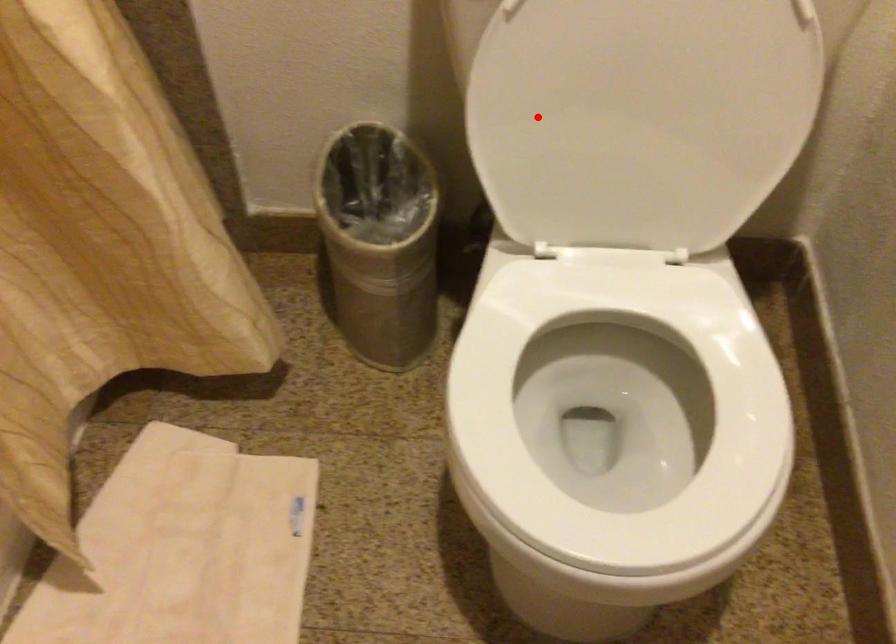
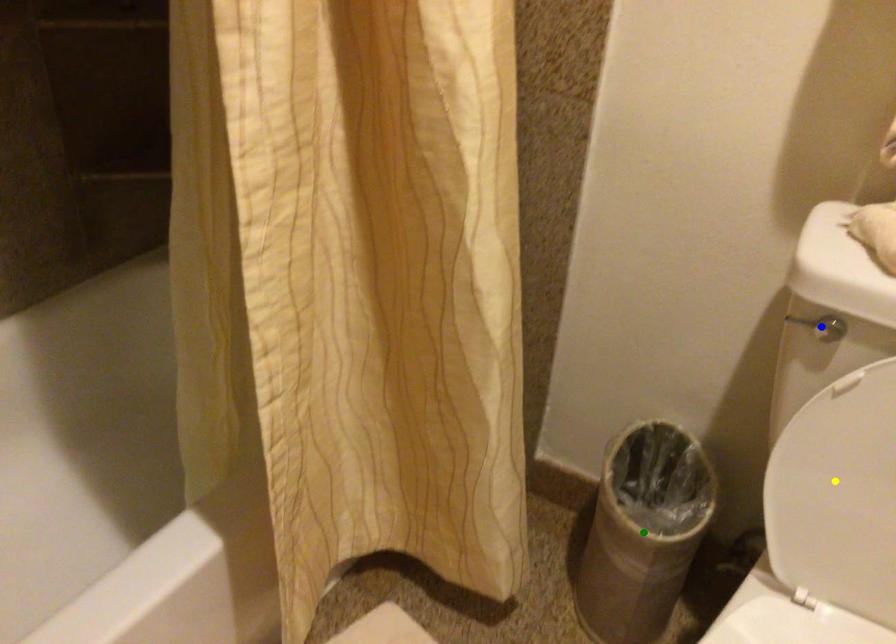
Question: I am providing you with two images of the same scene from different viewpoints. A red point is marked on the first image. You are given multiple points on the second image. Which point in image 2 is actually the same real-world point as the red point in image 1?

Choices:
 (A) green point
 (B) blue point
 (C) yellow point

Answer: (C)